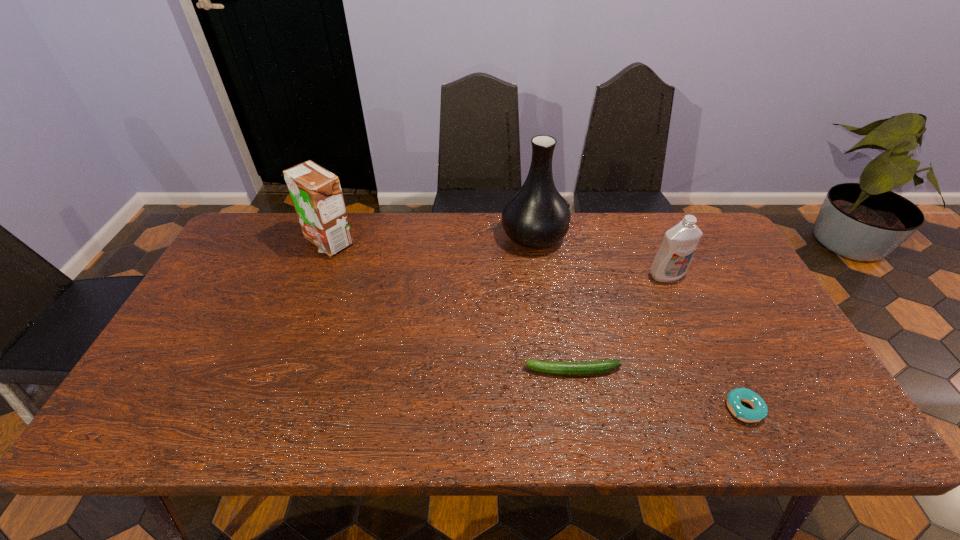
You are a GUI agent. You are given a task and a screenshot of the screen. Output one action in this format:
    pyautogui.click(x=<x>, y=<y>)
    Task: Click on the vase
    The height and width of the screenshot is (540, 960).
    Given the screenshot: What is the action you would take?
    pyautogui.click(x=536, y=216)

Where is `the leftmost object`? the leftmost object is located at coordinates (316, 193).

This screenshot has width=960, height=540. I want to click on the third shortest object, so click(x=675, y=254).

At what (x,y) coordinates should I click in order to perform the action: click on detergent. Please return your answer as a coordinate pair (x, y). Looking at the image, I should click on (675, 254).

I want to click on the fourth farthest object, so click(x=594, y=367).

The height and width of the screenshot is (540, 960). In order to click on the nearest object in this screenshot , I will do `click(760, 410)`.

At what (x,y) coordinates should I click in order to perform the action: click on free spot located 0.370m on the left of the vase. Please return your answer as a coordinate pair (x, y). Looking at the image, I should click on (388, 237).

Locate an element on the screen. free region located 0.120m on the straw side of the leftmost object is located at coordinates (312, 286).

Locate an element on the screen. vacant space situated on the back of the third farthest object is located at coordinates (652, 241).

You are a GUI agent. You are given a task and a screenshot of the screen. Output one action in this format:
    pyautogui.click(x=<x>, y=<y>)
    Task: Click on the vacant space located on the front-facing side of the fourth farthest object
    The height and width of the screenshot is (540, 960).
    Given the screenshot: What is the action you would take?
    pyautogui.click(x=451, y=371)